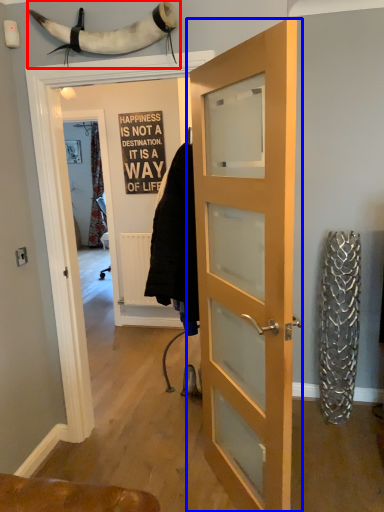
Question: Which of the following is the closest to the observer, animal (highlighted by a red box) or door (highlighted by a blue box)?

Choices:
 (A) animal
 (B) door

Answer: (B)